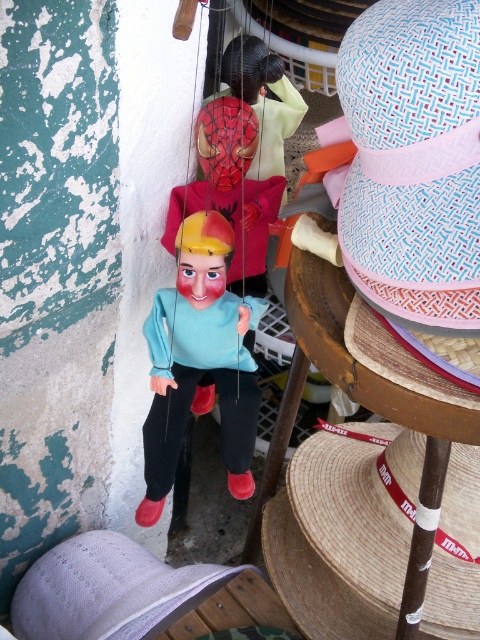
You are a puppeteer setting up for a show and notice two hats on the ground. You need to place a new puppet between them. The puppet is exactly in the middle of the two hats. Which hat is closer to the puppet? The puppet is positioned between the straw hat at lower right and the lavender woven straw hat at lower left.

The puppet is exactly in the middle of the two hats, so both the straw hat at lower right and the lavender woven straw hat at lower left are equally close to the puppet.